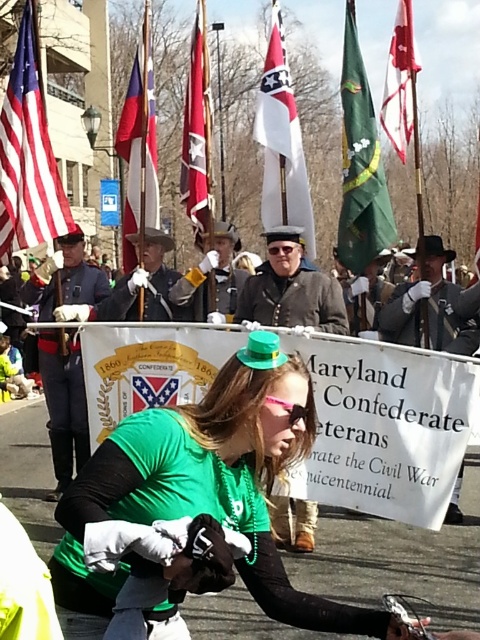
You are a photographer standing at the front of the scene. You want to take a photo that includes both the shiny blue uniform at center and the red flag at center. What is the minimum distance you need to step back to ensure both are in frame?

The shiny blue uniform at center is 3.70 feet away from the red flag at center. To capture both in the frame, you need to step back at least half of that distance, so approximately 1.85 feet.

You are a photographer at the event. You want to capture a photo where the matte brown uniform at center is visible above the red cotton flag at center. Is this possible based on their current positions?

The matte brown uniform at center is below the red cotton flag at center, so it would not be possible to capture a photo where the matte brown uniform at center is visible above the red cotton flag at center unless the flag is moved or the angle is adjusted.